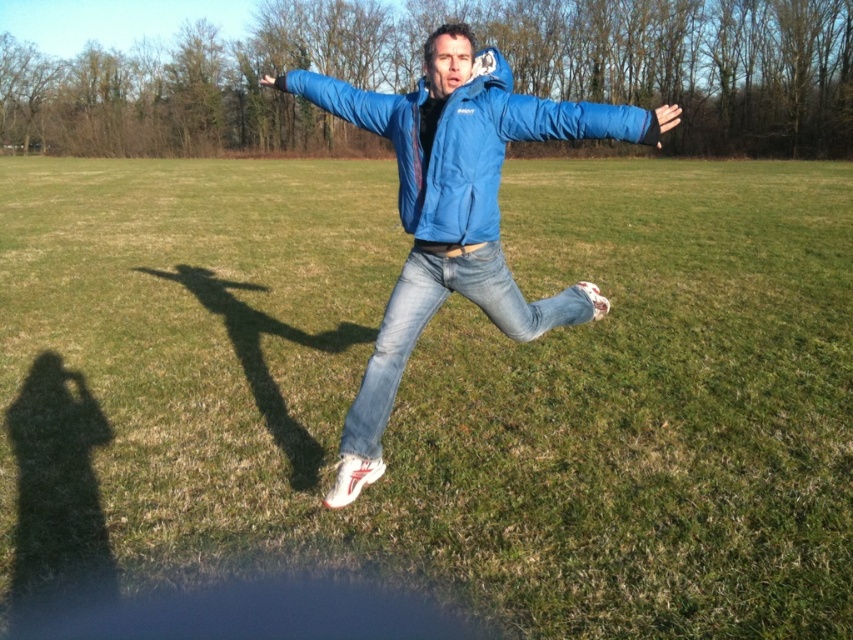
Is point (595, 132) more distant than point (375, 378)?

No, (595, 132) is closer to viewer.

Is point (457, 150) less distant than point (440, 280)?

Yes.

This screenshot has height=640, width=853. I want to click on blue matte jacket at center, so click(456, 209).

The width and height of the screenshot is (853, 640). What are the coordinates of `blue matte jacket at center` in the screenshot? It's located at (456, 209).

Can you confirm if blue synthetic jacket at center is smaller than jeans at center?

Yes, blue synthetic jacket at center is smaller than jeans at center.

Is blue synthetic jacket at center below jeans at center?

No, blue synthetic jacket at center is not below jeans at center.

Who is more distant from viewer, (479, 176) or (450, 268)?

Positioned behind is point (450, 268).

The image size is (853, 640). I want to click on blue synthetic jacket at center, so click(x=463, y=140).

Who is positioned more to the left, blue matte jacket at center or blue synthetic jacket at center?

blue synthetic jacket at center

Does blue matte jacket at center appear over blue synthetic jacket at center?

No, blue matte jacket at center is not above blue synthetic jacket at center.

This screenshot has height=640, width=853. Find the location of `blue matte jacket at center`. blue matte jacket at center is located at coordinates (456, 209).